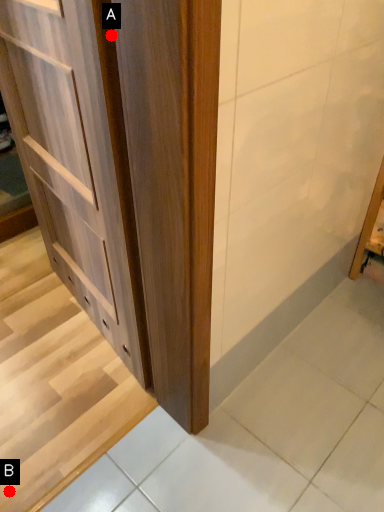
Question: Two points are circled on the image, labeled by A and B beside each circle. Which of the following is the closest to the observer?

Choices:
 (A) A is closer
 (B) B is closer

Answer: (A)